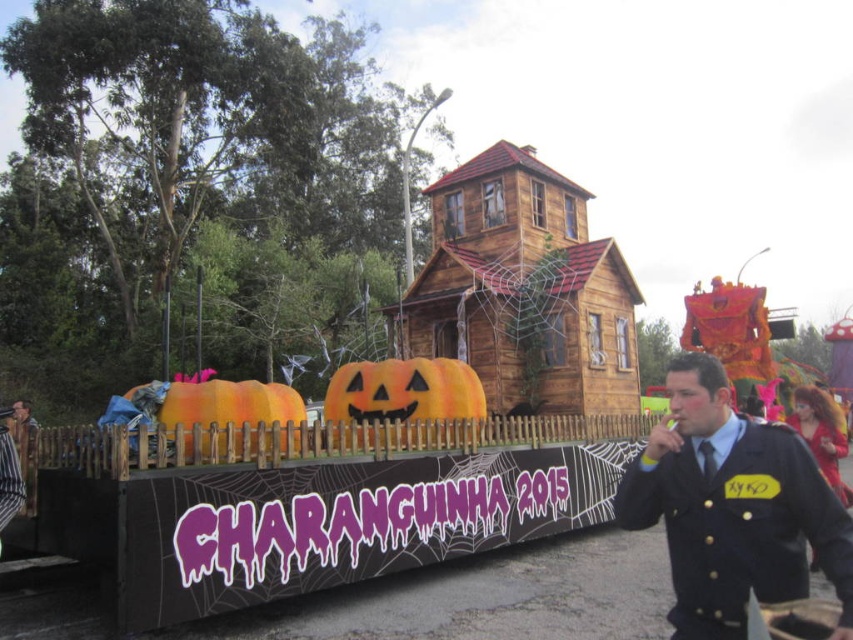
Between black uniform at center and orange plush pumpkin at center, which one is positioned lower?

black uniform at center is lower down.

Identify the location of black uniform at center. This screenshot has width=853, height=640. (732, 508).

This screenshot has width=853, height=640. I want to click on black uniform at center, so click(x=732, y=508).

Looking at this image, which is below, black uniform at center or dark blue uniform at center?

dark blue uniform at center

Does black uniform at center appear on the left side of dark blue uniform at center?

Incorrect, black uniform at center is not on the left side of dark blue uniform at center.

Where is `black uniform at center`? The height and width of the screenshot is (640, 853). black uniform at center is located at coordinates (732, 508).

Between point (424, 388) and point (187, 381), which one is positioned in front?

Point (424, 388) is in front.

Is point (439, 378) more distant than point (178, 394)?

Yes, it is.

Does point (363, 404) lie behind point (209, 381)?

Yes, point (363, 404) is behind point (209, 381).

Identify the location of orange plush pumpkin at center. (404, 392).